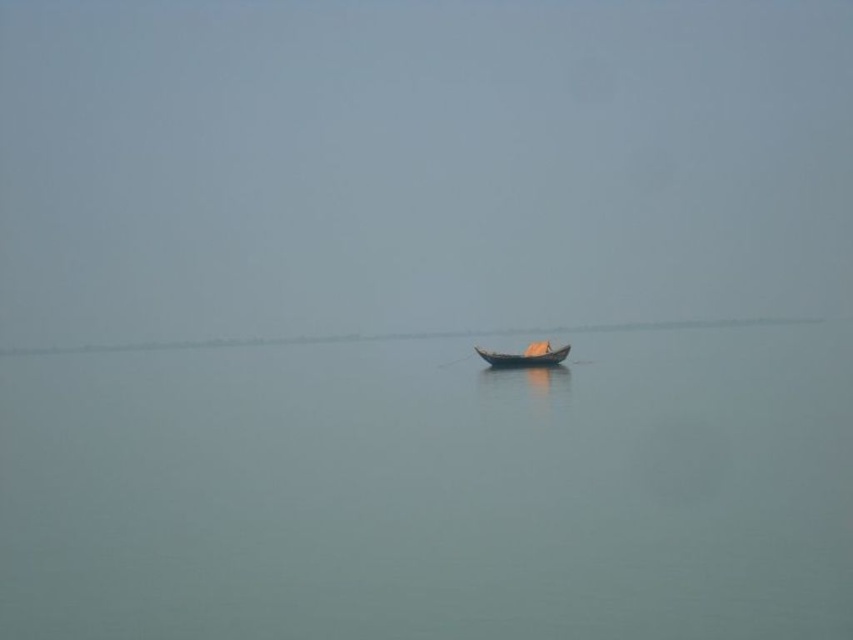
Can you confirm if foggy mist at center is taller than smooth water at center?

Correct, foggy mist at center is much taller as smooth water at center.

Is foggy mist at center bigger than smooth water at center?

Correct, foggy mist at center is larger in size than smooth water at center.

Is point (744, 314) positioned before point (233, 595)?

No, it is not.

Where is `foggy mist at center`? This screenshot has height=640, width=853. foggy mist at center is located at coordinates (418, 164).

Measure the distance between smooth water at center and camera.

smooth water at center and camera are 61.82 feet apart from each other.

Is smooth water at center in front of wooden boat at center?

Yes, smooth water at center is closer to the viewer.

Is point (801, 378) farther from viewer compared to point (538, 356)?

That is False.

Identify the location of smooth water at center. 432,492.

Does foggy mist at center appear over wooden boat at center?

Correct, foggy mist at center is located above wooden boat at center.

In the scene shown: Which is more to the left, foggy mist at center or wooden boat at center?

Positioned to the left is foggy mist at center.

What do you see at coordinates (418, 164) in the screenshot?
I see `foggy mist at center` at bounding box center [418, 164].

Image resolution: width=853 pixels, height=640 pixels. I want to click on foggy mist at center, so click(418, 164).